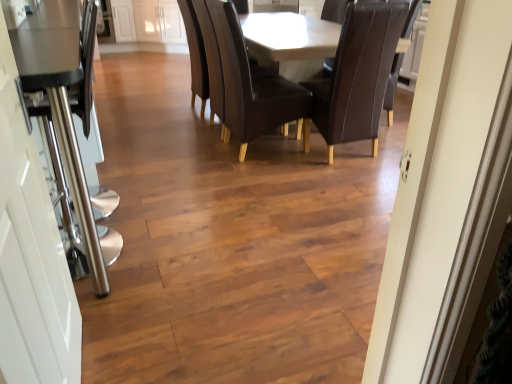
Question: From a real-world perspective, is dark brown leather armchair at center positioned above or below brown leather chair at center, the 2th chair when ordered from left to right?

Choices:
 (A) above
 (B) below

Answer: (B)

Question: Considering the positions of dark brown leather armchair at center and brown leather chair at center, the 1th chair from the right, in the image, is dark brown leather armchair at center taller or shorter than brown leather chair at center, the 1th chair from the right,?

Choices:
 (A) tall
 (B) short

Answer: (B)

Question: Based on their relative distances, which object is farther from the matte brown table at center?

Choices:
 (A) dark brown leather armchair at center
 (B) brown leather chair at center, the 1th chair from the right
 (C) brown leather chair at center, which is the 2th chair from right to left
 (D) white glossy door at left

Answer: (D)

Question: Considering the real-world distances, which object is farthest from the dark brown leather armchair at center?

Choices:
 (A) matte brown table at center
 (B) brown leather chair at center, acting as the first chair starting from the left
 (C) brown leather chair at center, the 1th chair from the right
 (D) white glossy door at left

Answer: (D)